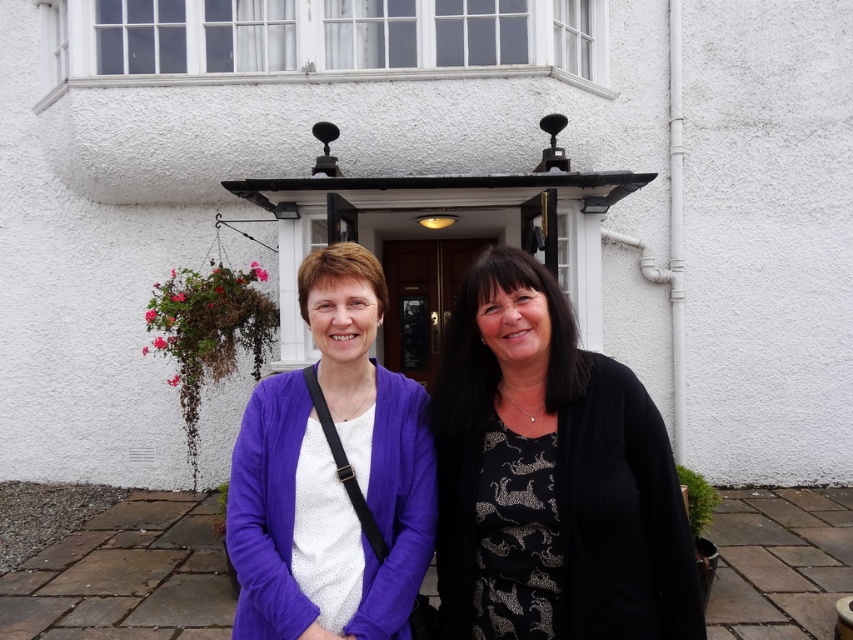
Question: Is black textured dress at center positioned at the back of purple fabric sweater at center?

Choices:
 (A) yes
 (B) no

Answer: (B)

Question: Does black textured dress at center have a greater width compared to purple fabric sweater at center?

Choices:
 (A) no
 (B) yes

Answer: (B)

Question: Which point is closer to the camera?

Choices:
 (A) purple fabric sweater at center
 (B) black textured dress at center

Answer: (B)

Question: Is black textured dress at center below purple fabric sweater at center?

Choices:
 (A) yes
 (B) no

Answer: (A)